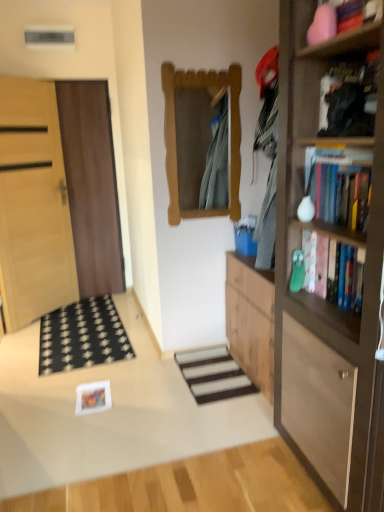
In order to click on free space below wooden mirror at center (from a real-world perspective) in this screenshot , I will do `click(203, 348)`.